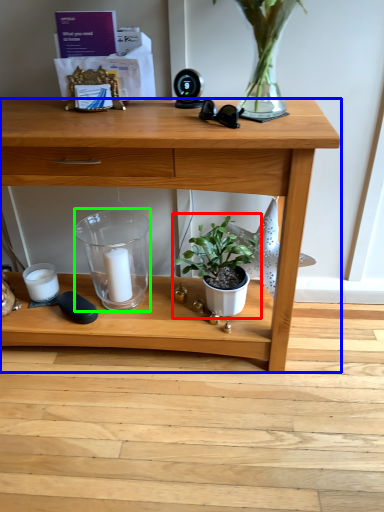
Question: Which object is the closest to the houseplant (highlighted by a red box)? Choose among these: desk (highlighted by a blue box) or glass vase (highlighted by a green box).

Choices:
 (A) desk
 (B) glass vase

Answer: (A)